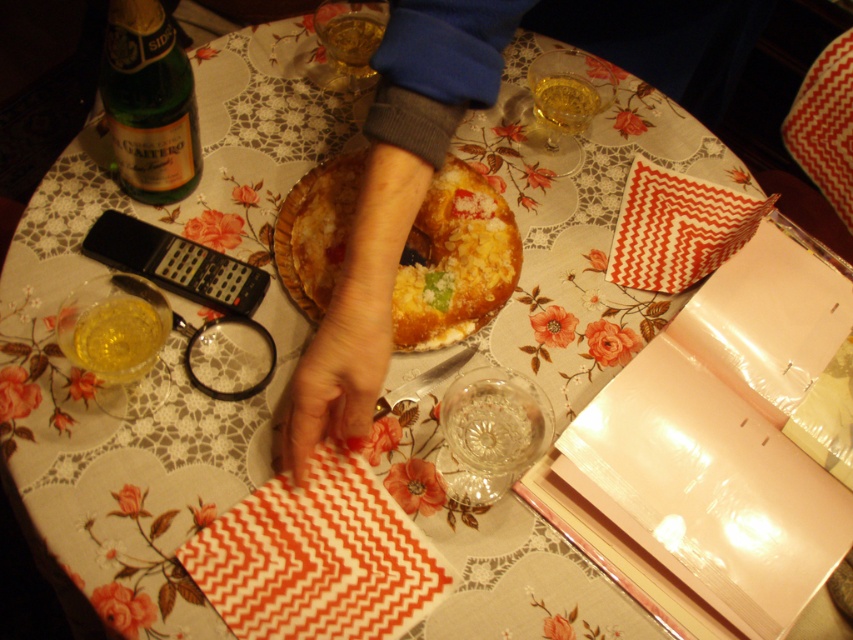
Between smooth skin hand at center and yellow cake at center, which one appears on the right side from the viewer's perspective?

yellow cake at center is more to the right.

Can you confirm if smooth skin hand at center is smaller than yellow cake at center?

No, smooth skin hand at center is not smaller than yellow cake at center.

Who is more distant from viewer, (x=422, y=129) or (x=453, y=243)?

Positioned behind is point (x=453, y=243).

Identify the location of smooth skin hand at center. This screenshot has height=640, width=853. coord(393,202).

Can you confirm if smooth skin hand at center is positioned to the left of dry skin at center?

In fact, smooth skin hand at center is to the right of dry skin at center.

From the picture: Does smooth skin hand at center come in front of dry skin at center?

Yes, smooth skin hand at center is closer to the viewer.

Is point (434, 33) positioned after point (296, 433)?

Yes, point (434, 33) is farther from viewer.

The height and width of the screenshot is (640, 853). Identify the location of smooth skin hand at center. (393, 202).

Does green glass bottle at upper left have a greater height compared to translucent glass at upper center?

Indeed, green glass bottle at upper left has a greater height compared to translucent glass at upper center.

Is green glass bottle at upper left shorter than translucent glass at upper center?

Incorrect, green glass bottle at upper left's height does not fall short of translucent glass at upper center's.

Who is more forward, (148,161) or (560,124)?

Point (148,161) is more forward.

Locate an element on the screen. The width and height of the screenshot is (853, 640). green glass bottle at upper left is located at coordinates (149, 102).